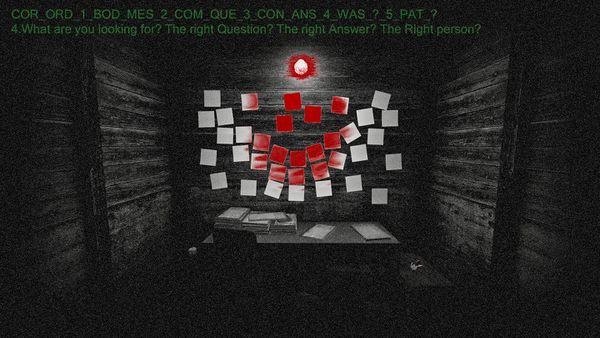
I want to click on stacks of books, so click(x=233, y=221), click(x=247, y=226), click(x=286, y=227).